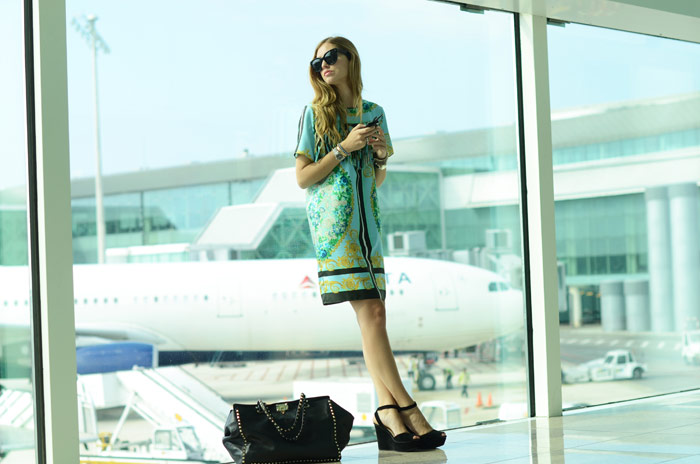
The width and height of the screenshot is (700, 464). In order to click on floor in this screenshot , I will do `click(619, 447)`.